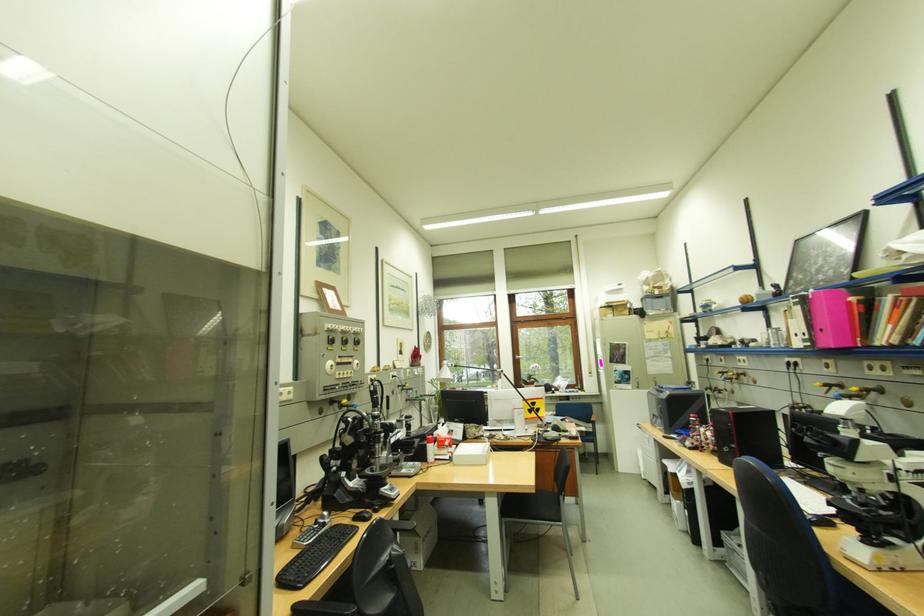
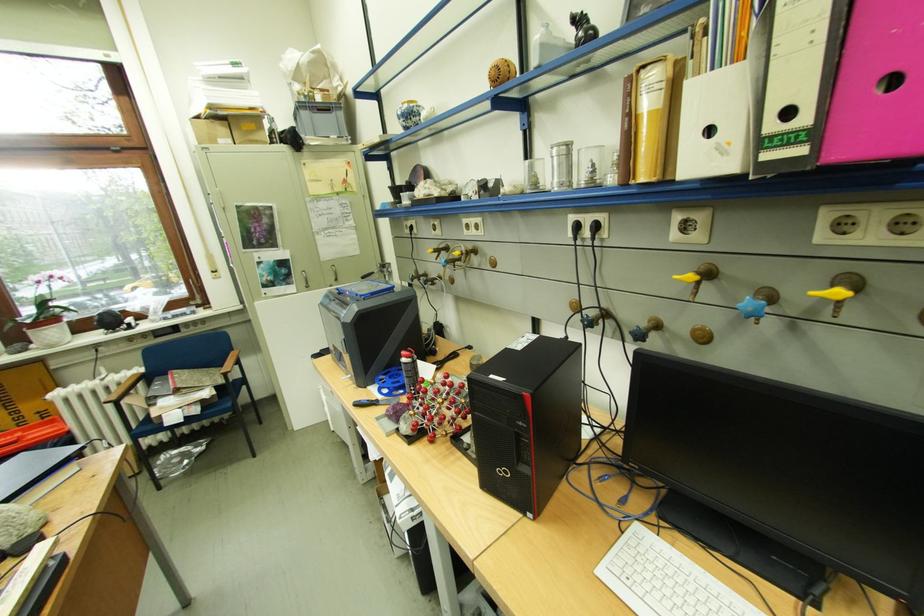
The point at (699, 445) is marked in the first image. Where is the corresponding point in the second image?

(415, 429)